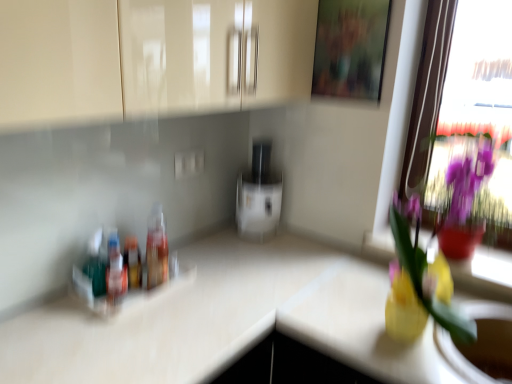
Question: Is translucent plastic bottles at left, acting as the third bottle starting from the right, positioned beyond the bounds of wooden frame at upper center?

Choices:
 (A) yes
 (B) no

Answer: (A)

Question: Does translucent plastic bottles at left, the first bottle when ordered from left to right, have a greater height compared to wooden frame at upper center?

Choices:
 (A) no
 (B) yes

Answer: (A)

Question: Can you confirm if translucent plastic bottles at left, acting as the third bottle starting from the right, is smaller than wooden frame at upper center?

Choices:
 (A) yes
 (B) no

Answer: (A)

Question: From a real-world perspective, is translucent plastic bottles at left, acting as the third bottle starting from the right, physically above wooden frame at upper center?

Choices:
 (A) no
 (B) yes

Answer: (A)

Question: Are translucent plastic bottles at left, the first bottle when ordered from left to right, and wooden frame at upper center far apart?

Choices:
 (A) no
 (B) yes

Answer: (B)

Question: Is point (289, 43) positioned closer to the camera than point (266, 213)?

Choices:
 (A) closer
 (B) farther

Answer: (A)

Question: Is glossy beige cabinet at upper center spatially inside white glossy toaster at center, or outside of it?

Choices:
 (A) outside
 (B) inside

Answer: (A)

Question: From a real-world perspective, relative to white glossy toaster at center, is glossy beige cabinet at upper center vertically above or below?

Choices:
 (A) above
 (B) below

Answer: (A)

Question: From the image's perspective, is glossy beige cabinet at upper center positioned above or below white glossy toaster at center?

Choices:
 (A) below
 (B) above

Answer: (B)

Question: Based on their sizes in the image, would you say white glossy toaster at center is bigger or smaller than translucent plastic bottle at center, positioned as the first bottle in right-to-left order?

Choices:
 (A) big
 (B) small

Answer: (A)

Question: Is point (275, 200) closer or farther from the camera than point (158, 205)?

Choices:
 (A) farther
 (B) closer

Answer: (A)

Question: From the image's perspective, relative to translucent plastic bottle at center, the third bottle when ordered from left to right, is white glossy toaster at center above or below?

Choices:
 (A) below
 (B) above

Answer: (B)

Question: Considering their positions, is white glossy toaster at center located in front of or behind translucent plastic bottle at center, positioned as the first bottle in right-to-left order?

Choices:
 (A) behind
 (B) front

Answer: (A)

Question: From a real-world perspective, relative to glossy beige cabinet at upper center, is wooden frame at upper center vertically above or below?

Choices:
 (A) below
 (B) above

Answer: (B)

Question: From their relative heights in the image, would you say wooden frame at upper center is taller or shorter than glossy beige cabinet at upper center?

Choices:
 (A) short
 (B) tall

Answer: (B)